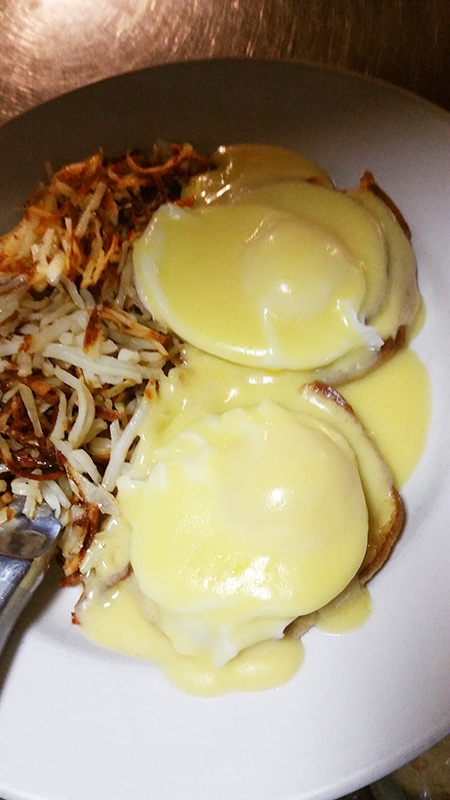
Where is `plate`? This screenshot has height=800, width=450. plate is located at coordinates (369, 710), (98, 758), (374, 132).